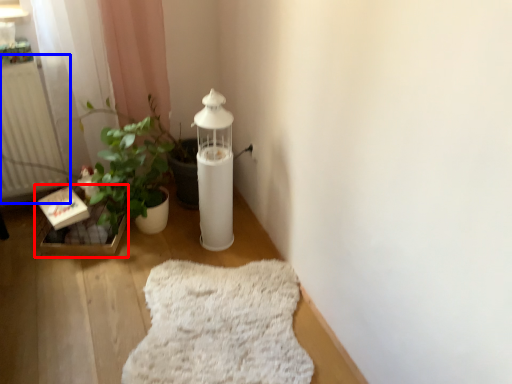
Question: Which of the following is the closest to the observer, window sill (highlighted by a red box) or radiator (highlighted by a blue box)?

Choices:
 (A) window sill
 (B) radiator

Answer: (B)